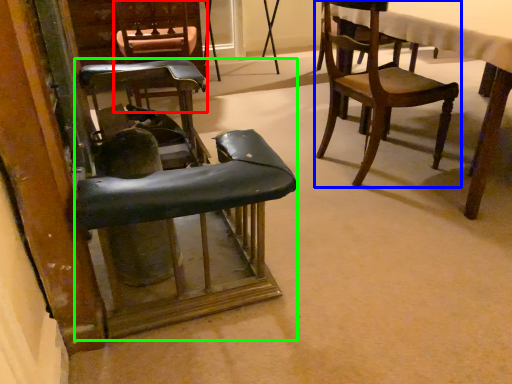
Question: Estimate the real-world distances between objects in this image. Which object is farther from chair (highlighted by a red box), chair (highlighted by a blue box) or chair (highlighted by a green box)?

Choices:
 (A) chair
 (B) chair

Answer: (B)